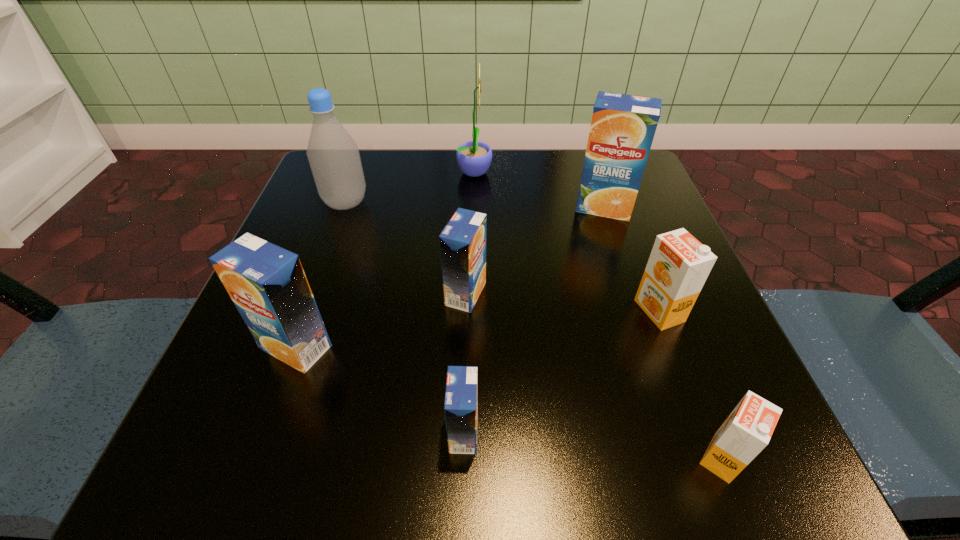
Find the location of `vacant space that satisfies the following two spatial constraints: 1. on the front-facing side of the farthest object; 2. on the front side of the smallest blue orange_juice`. vacant space that satisfies the following two spatial constraints: 1. on the front-facing side of the farthest object; 2. on the front side of the smallest blue orange_juice is located at coordinates (470, 433).